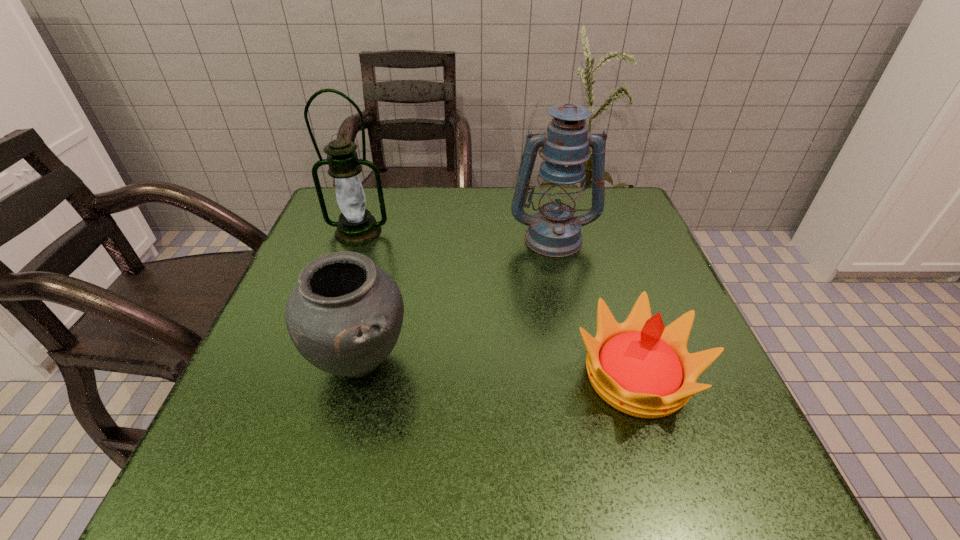
This screenshot has height=540, width=960. In order to click on the left lantern in this screenshot , I will do 356,226.

Where is `the right lantern`? This screenshot has height=540, width=960. the right lantern is located at coordinates (554, 231).

This screenshot has width=960, height=540. I want to click on the third tallest object, so click(344, 316).

Find the location of `the shortest object`. the shortest object is located at coordinates (640, 367).

Identify the location of vacant area located on the side where the left lantern emits light. (342, 277).

Where is `blank area located 0.230m on the front-facing side of the right lantern`? The width and height of the screenshot is (960, 540). blank area located 0.230m on the front-facing side of the right lantern is located at coordinates (573, 334).

What are the coordinates of `vacant space located on the back of the second shortest object` in the screenshot? It's located at (374, 305).

What are the coordinates of `vacant area located on the back of the shortest object` in the screenshot? It's located at (598, 260).

Find the location of a particular element. The width and height of the screenshot is (960, 540). lantern located in the left edge section of the desktop is located at coordinates (356, 226).

In order to click on urn that is at the left edge in this screenshot , I will do `click(344, 316)`.